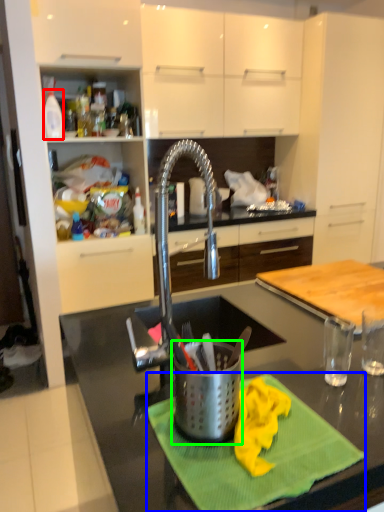
Question: Which object is the farthest from kitchen appliance (highlighted by a red box)? Choose among these: place mat (highlighted by a blue box) or appliance (highlighted by a green box).

Choices:
 (A) place mat
 (B) appliance

Answer: (A)